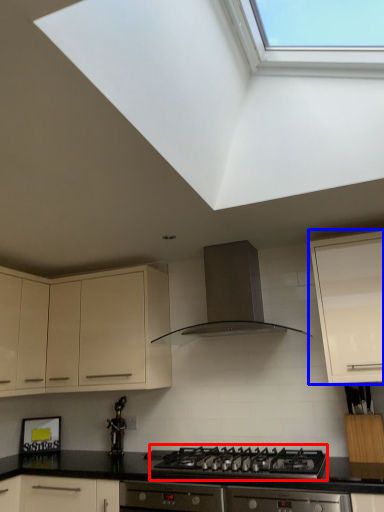
Question: Which object appears closest to the camera in this image, gas stove (highlighted by a red box) or cabinetry (highlighted by a blue box)?

Choices:
 (A) gas stove
 (B) cabinetry

Answer: (A)